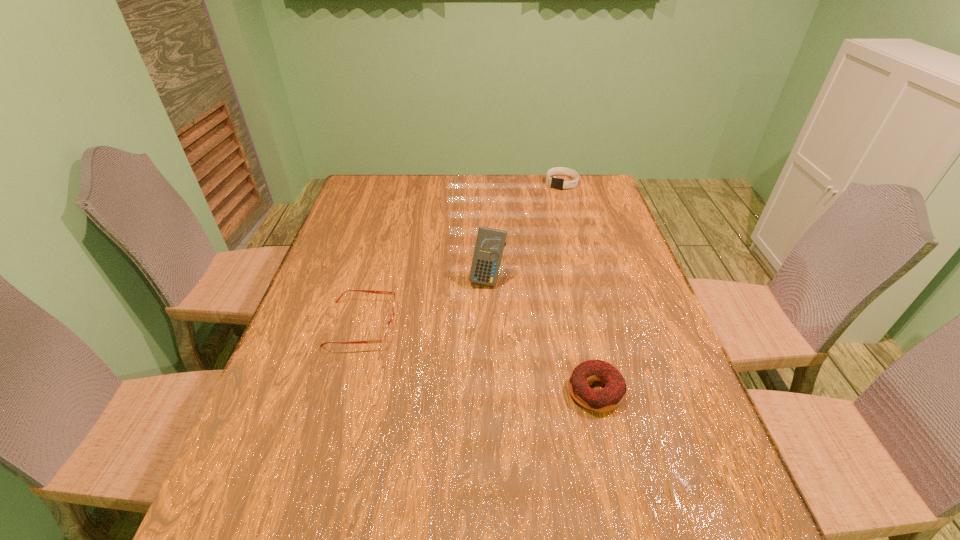
I want to click on free space on the desktop that is between the second nearest object and the nearest object and is positioned on the front-facing side of the calculator, so click(469, 355).

Where is `vacant space on the desktop that is between the leftmost object and the nearest object and is positioned on the outer surface of the farthest object`? The image size is (960, 540). vacant space on the desktop that is between the leftmost object and the nearest object and is positioned on the outer surface of the farthest object is located at coordinates (438, 346).